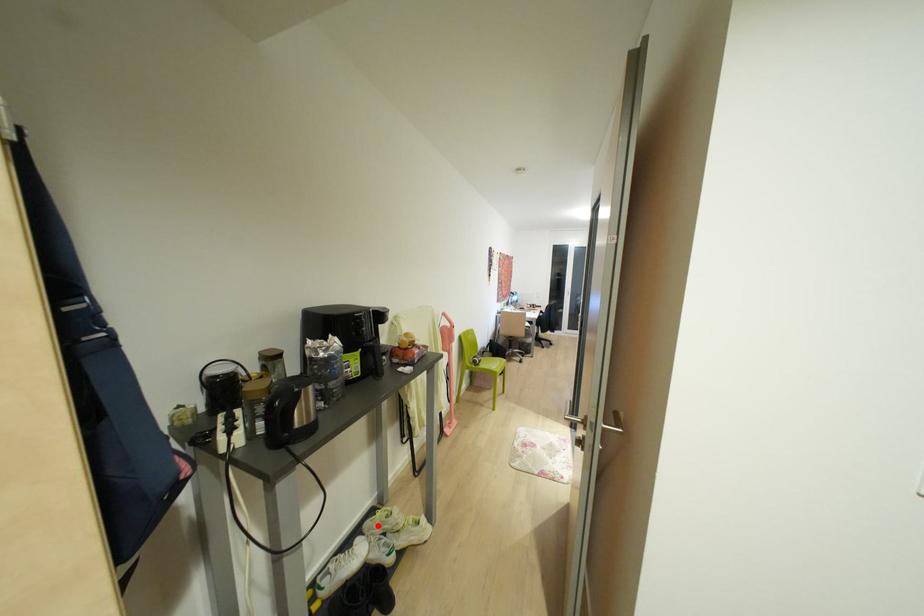
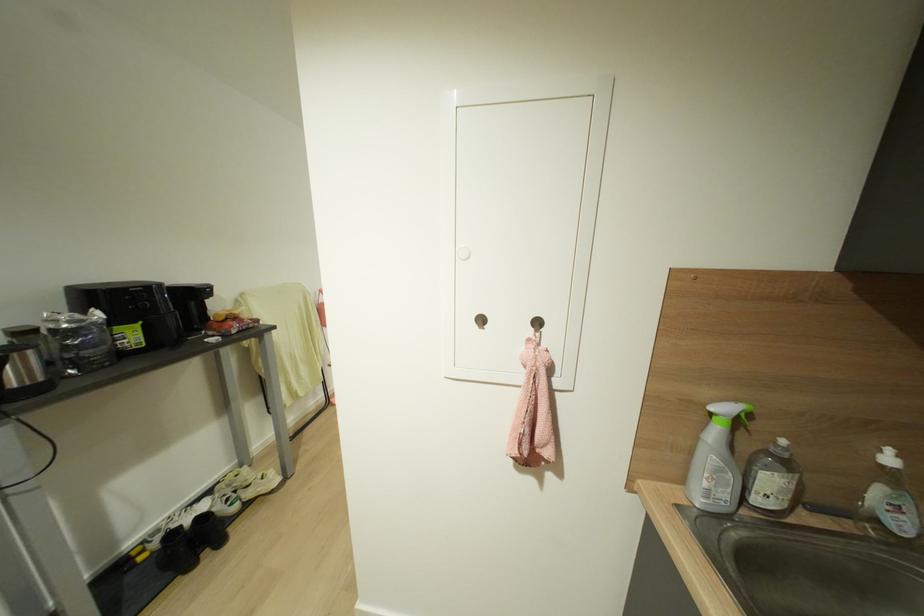
The point at the highlighted location is marked in the first image. Where is the corresponding point in the second image?

(227, 485)